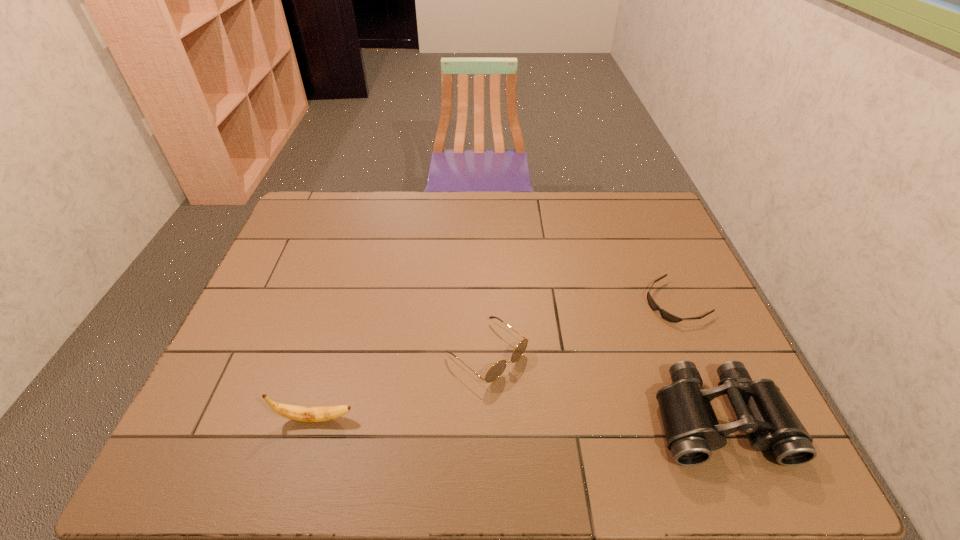
In the image, there is a desktop. Where is `vacant space at the left edge`? This screenshot has height=540, width=960. vacant space at the left edge is located at coordinates pyautogui.click(x=289, y=361).

The width and height of the screenshot is (960, 540). I want to click on vacant space at the right edge of the desktop, so click(x=646, y=251).

This screenshot has width=960, height=540. I want to click on free region at the far right corner, so click(638, 198).

Locate an element on the screen. blank region between the left sunglasses and the binoculars is located at coordinates (602, 386).

The height and width of the screenshot is (540, 960). In order to click on unoccupied position between the binoculars and the left sunglasses in this screenshot , I will do `click(602, 386)`.

You are a GUI agent. You are given a task and a screenshot of the screen. Output one action in this format:
    pyautogui.click(x=<x>, y=<y>)
    Task: Click on the free space between the leftmost object and the shortest object
    This screenshot has width=960, height=540.
    Given the screenshot: What is the action you would take?
    pyautogui.click(x=495, y=360)

Locate an element on the screen. The height and width of the screenshot is (540, 960). free space between the right sunglasses and the second shortest object is located at coordinates (581, 327).

Where is `free area in between the binoculars and the right sunglasses`? Image resolution: width=960 pixels, height=540 pixels. free area in between the binoculars and the right sunglasses is located at coordinates (697, 360).

I want to click on free space between the binoculars and the leftmost object, so click(x=516, y=418).

This screenshot has width=960, height=540. I want to click on free space between the right sunglasses and the banana, so click(x=495, y=360).